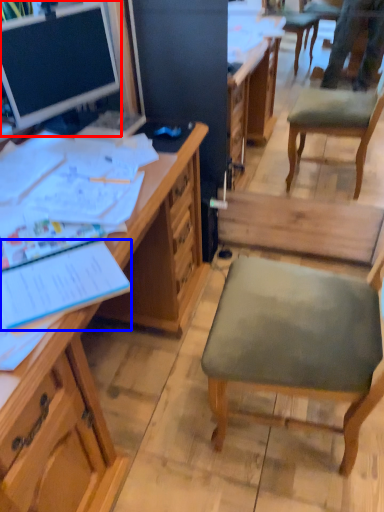
Question: Which of the following is the closest to the observer, desk (highlighted by a red box) or notebook (highlighted by a blue box)?

Choices:
 (A) desk
 (B) notebook

Answer: (B)